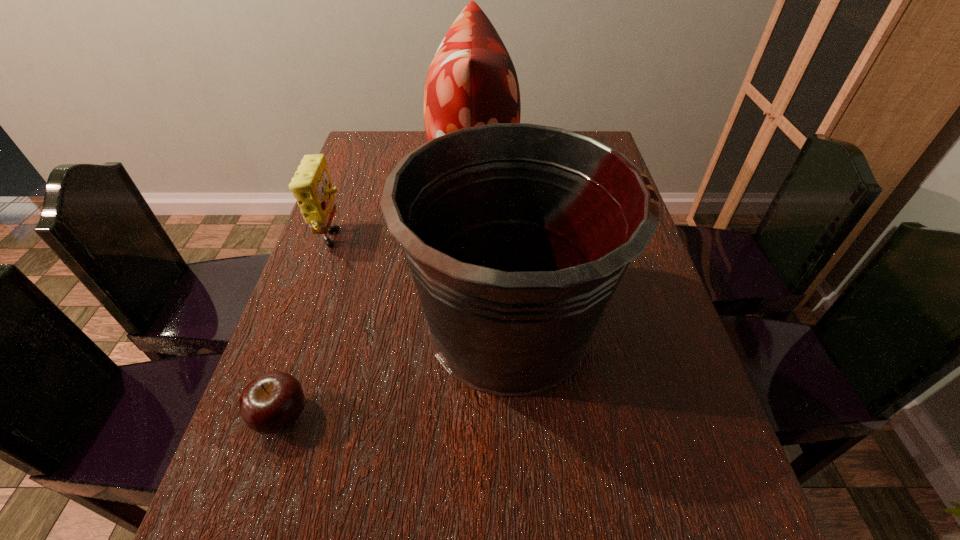
This screenshot has width=960, height=540. Find the location of `free space that satisfies the following two spatial constraints: 1. on the face of the bucket; 2. on the left side of the sponge`. free space that satisfies the following two spatial constraints: 1. on the face of the bucket; 2. on the left side of the sponge is located at coordinates (304, 325).

Where is `vacant space that satisfies the following two spatial constraints: 1. on the face of the shortest object; 2. on the left side of the third tallest object`? The height and width of the screenshot is (540, 960). vacant space that satisfies the following two spatial constraints: 1. on the face of the shortest object; 2. on the left side of the third tallest object is located at coordinates (273, 417).

At what (x,y) coordinates should I click in order to perform the action: click on vacant position in the image that satisfies the following two spatial constraints: 1. on the face of the sponge; 2. on the left side of the shortest object. Please return your answer as a coordinate pair (x, y). Looking at the image, I should click on (273, 417).

In order to click on vacant region that satisfies the following two spatial constraints: 1. on the back side of the bucket; 2. on the face of the second shortest object in this screenshot , I will do `click(504, 243)`.

Identify the location of blank area in the image that satisfies the following two spatial constraints: 1. on the front-facing side of the cushion; 2. on the back side of the bucket. (470, 325).

Identify the location of vacant space that satisfies the following two spatial constraints: 1. on the front-facing side of the cushion; 2. on the back side of the bucket. This screenshot has height=540, width=960. (470, 325).

I want to click on free space that satisfies the following two spatial constraints: 1. on the face of the bucket; 2. on the right side of the third tallest object, so click(304, 325).

What are the coordinates of `vacant space that satisfies the following two spatial constraints: 1. on the back side of the apple; 2. on the face of the third tallest object` in the screenshot? It's located at (340, 243).